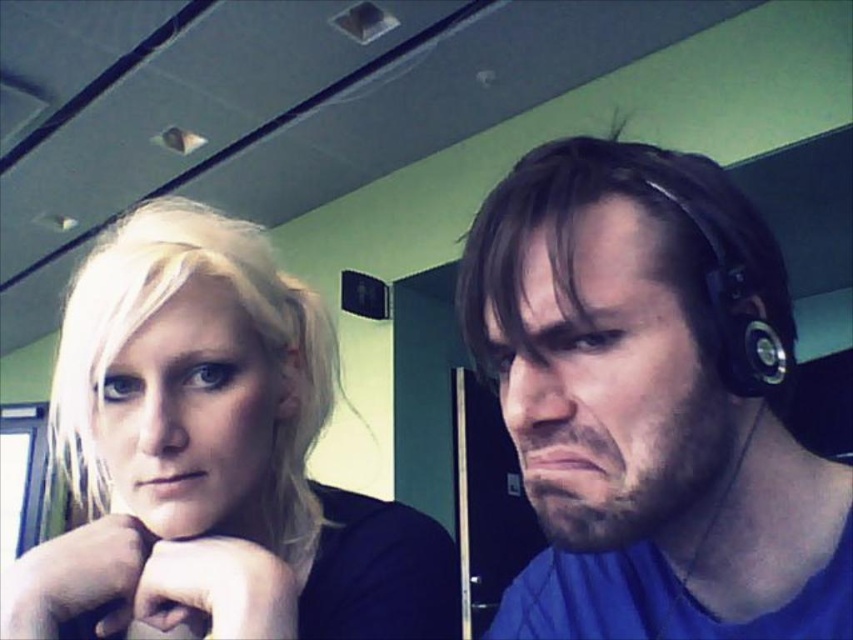
You are an interior designer planning to place a new lamp in the room. The lamp has a height of 0.7 meters. The point at coordinates point is (x=647, y=403). The lamp must be placed so that it doesn t block the view of the matte black headphones at right. What is the minimum height the lamp should have to ensure it doesn t block the view?

The point at coordinates point is (x=647, y=403) corresponds to the matte black headphones at right. To ensure the lamp doesn t block the view, the lamp should be placed at a height lower than the headphones. Since the lamp has a height of 0.7 meters, it should be placed at a height below 0.7 meters to avoid blocking the view.

You are holding a 12 inch ruler and want to measure the distance between the point at coordinates point (636, 148) and the camera. Can you determine if the ruler will be sufficient to measure this distance?

The distance between the point at coordinates point (636, 148) and the camera is 16.19 inches. Since the ruler is only 12 inches long, it is not long enough to measure the full distance. You would need a longer measuring tool.

You are an interior designer assessing the layout of this indoor space. You notice the blonde hair at left and the black rubber earphone at right. Which object occupies a larger spatial area in the image?

The blonde hair at left is bigger than the black rubber earphone at right, so the blonde hair at left occupies a larger spatial area in the image.